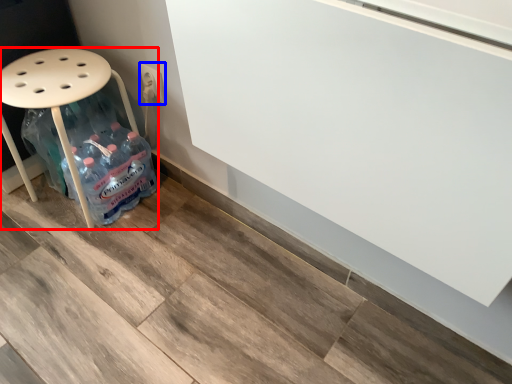
Question: Which object is closer to the camera taking this photo, furniture (highlighted by a red box) or electric outlet (highlighted by a blue box)?

Choices:
 (A) furniture
 (B) electric outlet

Answer: (A)